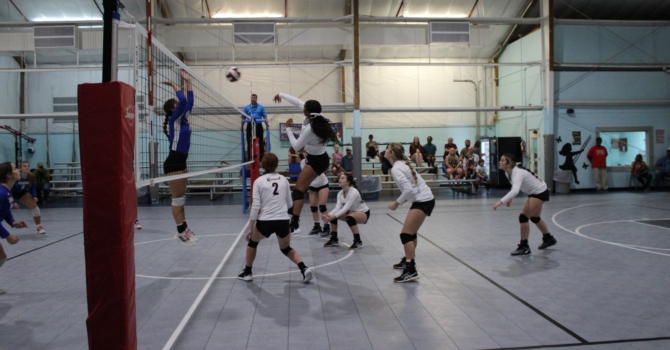
You are a GUI agent. You are given a task and a screenshot of the screen. Output one action in this format:
    pyautogui.click(x=<x>, y=<y>)
    Task: Click on the windows
    
    Given the screenshot: What is the action you would take?
    pyautogui.click(x=624, y=153), pyautogui.click(x=534, y=149)